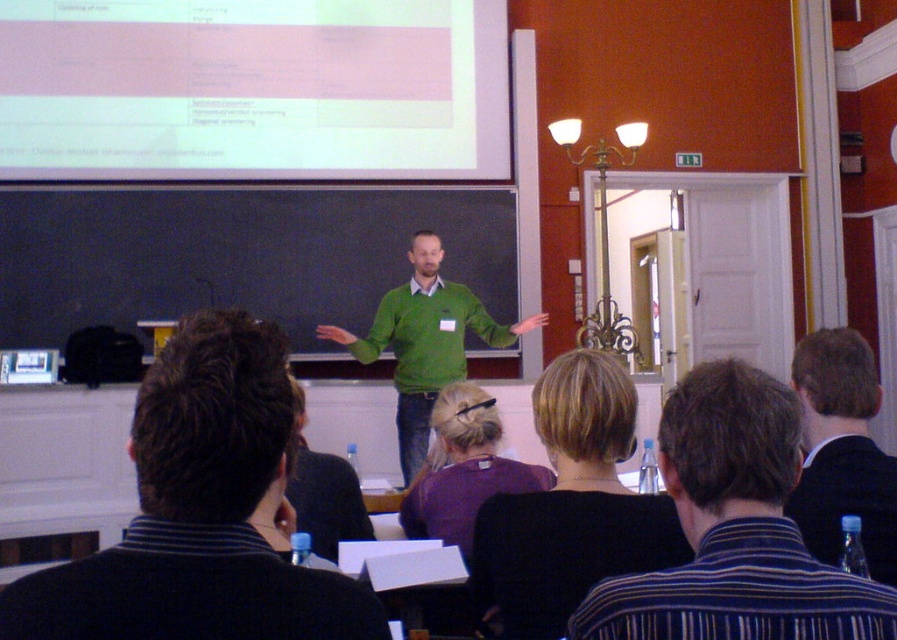
How far apart are dark suit jacket at right and green matte sweater at center?

dark suit jacket at right and green matte sweater at center are 10.49 feet apart.

How distant is dark suit jacket at right from green matte sweater at center?

3.20 meters

Find the location of a particular element. The height and width of the screenshot is (640, 897). dark suit jacket at right is located at coordinates (842, 451).

This screenshot has width=897, height=640. In order to click on dark suit jacket at right in this screenshot , I will do `click(842, 451)`.

Can you confirm if dark green sweater at center is taller than dark brown hair at center?

No, dark green sweater at center is not taller than dark brown hair at center.

Is the position of dark green sweater at center less distant than that of dark brown hair at center?

Yes, dark green sweater at center is in front of dark brown hair at center.

What are the coordinates of `dark green sweater at center` in the screenshot? It's located at (199, 513).

This screenshot has height=640, width=897. I want to click on dark green sweater at center, so click(x=199, y=513).

Is point (362, 584) positioned behind point (815, 401)?

No, (362, 584) is closer to viewer.

How far apart are dark green sweater at center and dark suit jacket at right?

dark green sweater at center is 3.45 feet away from dark suit jacket at right.

Identify the location of dark green sweater at center. The width and height of the screenshot is (897, 640). (199, 513).

The image size is (897, 640). I want to click on dark green sweater at center, so click(x=199, y=513).